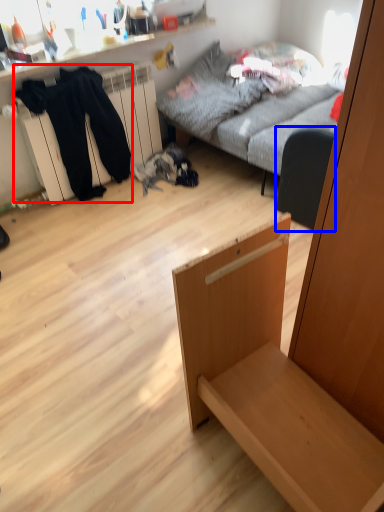
Question: Among these objects, which one is farthest to the camera, clothing (highlighted by a red box) or armchair (highlighted by a blue box)?

Choices:
 (A) clothing
 (B) armchair

Answer: (A)